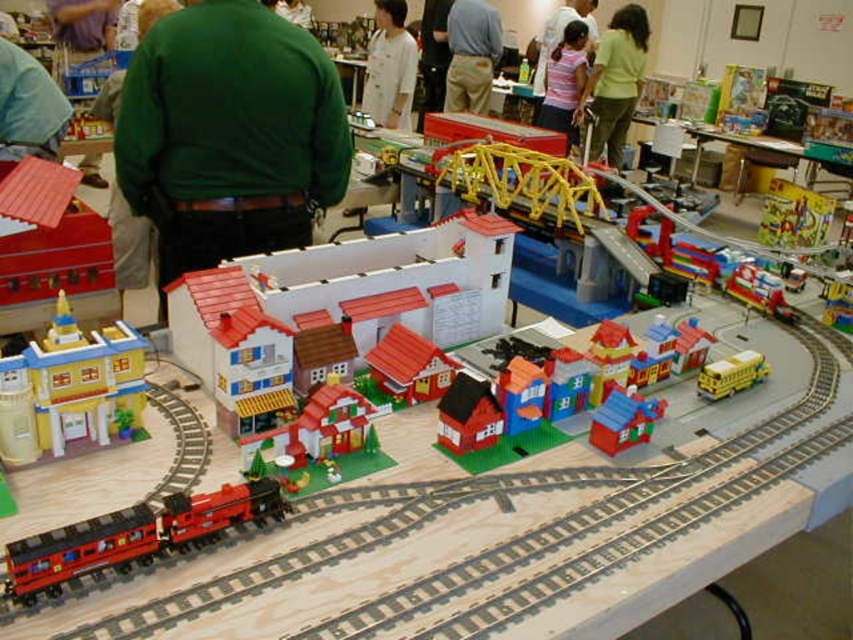
Question: Where is shiny red train at lower left located in relation to green matte shirt at upper left in the image?

Choices:
 (A) left
 (B) right

Answer: (B)

Question: Does yellow plastic building at left have a greater width compared to blue plastic house at center?

Choices:
 (A) yes
 (B) no

Answer: (A)

Question: Which point appears farthest from the camera in this image?

Choices:
 (A) (410, 92)
 (B) (605, 80)
 (C) (4, 131)

Answer: (B)

Question: Which of these objects is positioned farthest from the white smooth shirt at center?

Choices:
 (A) green matte sweater at upper left
 (B) green matte shirt at upper center
 (C) light blue shirt at center

Answer: (A)

Question: Estimate the real-world distances between objects in this image. Which object is closer to the green matte shirt at upper left?

Choices:
 (A) yellow matte school bus at center-right
 (B) blue plastic house at center

Answer: (B)

Question: Can you confirm if white smooth shirt at center is positioned to the left of smooth plastic house at center?

Choices:
 (A) yes
 (B) no

Answer: (A)